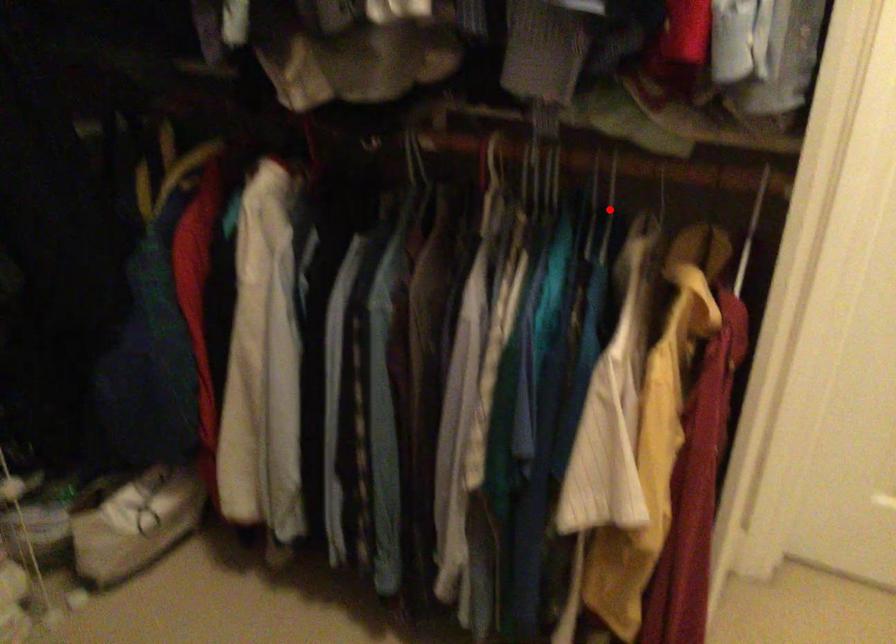
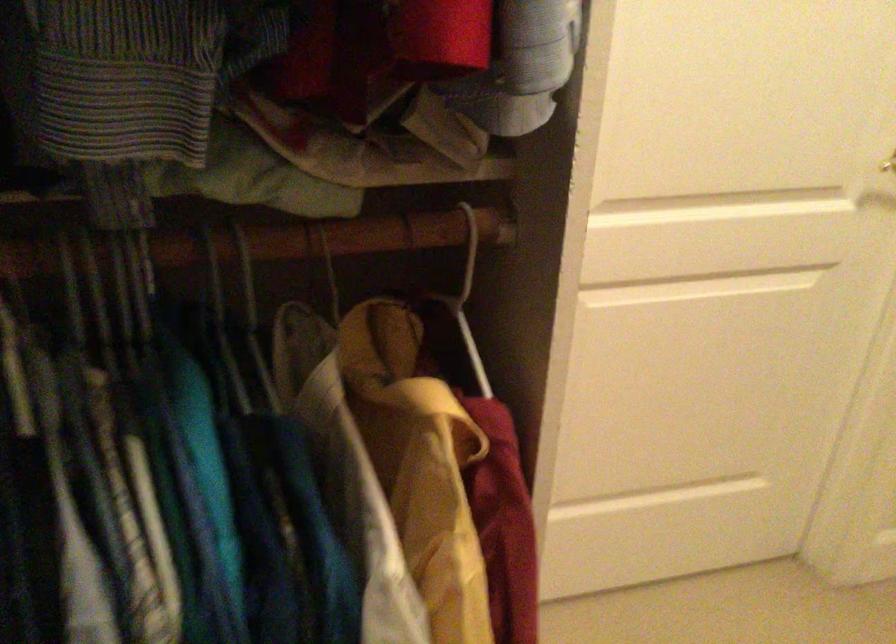
Question: A red point is marked in image1. In image2, is the corresponding 3D point closer to the camera or farther? Reply with the corresponding letter.

Choices:
 (A) The corresponding 3D point is closer.
 (B) The corresponding 3D point is farther.

Answer: (A)